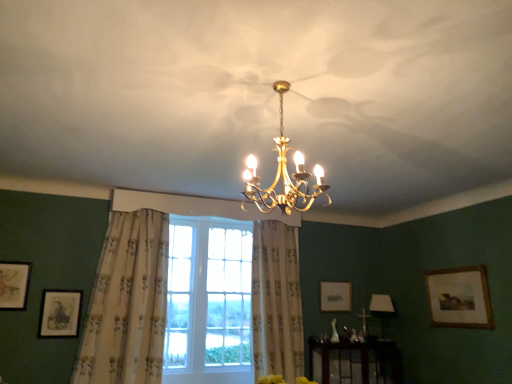
You are a GUI agent. You are given a task and a screenshot of the screen. Output one action in this format:
    pyautogui.click(x=<x>, y=<y>)
    Task: Click on the matte white lampshade at lower right, positioned as the 2th lamp in front-to-back order
    
    Given the screenshot: What is the action you would take?
    pyautogui.click(x=382, y=309)

This screenshot has width=512, height=384. Identify the location of beige floral fabric curtain at center, which ranks as the first curtain in right-to-left order. (276, 301).

This screenshot has width=512, height=384. What do you see at coordinates (459, 298) in the screenshot? I see `wooden framed painting at right, which appears as the first picture frame when viewed from the right` at bounding box center [459, 298].

Describe the element at coordinates (283, 175) in the screenshot. I see `gold metallic chandelier at center, the 2th lamp positioned from the back` at that location.

What do you see at coordinates (355, 362) in the screenshot? This screenshot has width=512, height=384. I see `wooden cabinet at lower center` at bounding box center [355, 362].

Identify the location of matte silver picture frame at center-right, the first picture frame positioned from the back. The height and width of the screenshot is (384, 512). (335, 296).

Which is more to the right, matte white lampshade at lower right, placed as the first lamp when sorted from back to front, or beige floral fabric curtain at center, which ranks as the first curtain in right-to-left order?

matte white lampshade at lower right, placed as the first lamp when sorted from back to front, is more to the right.

Is point (389, 300) farther from viewer compared to point (289, 323)?

Yes.

Could beige floral fabric curtain at center, which ranks as the first curtain in right-to-left order, be considered to be inside matte white lampshade at lower right, placed as the first lamp when sorted from back to front?

Actually, beige floral fabric curtain at center, which ranks as the first curtain in right-to-left order, is outside matte white lampshade at lower right, placed as the first lamp when sorted from back to front.

Could you tell me if matte white lampshade at lower right, placed as the first lamp when sorted from back to front, is turned towards beige floral fabric curtain at center, the 2th curtain positioned from the left?

No, matte white lampshade at lower right, placed as the first lamp when sorted from back to front, is not oriented towards beige floral fabric curtain at center, the 2th curtain positioned from the left.

Considering the positions of objects white floral fabric curtain at left, arranged as the 2th curtain when viewed from the right, and wooden cabinet at lower center in the image provided, who is in front, white floral fabric curtain at left, arranged as the 2th curtain when viewed from the right, or wooden cabinet at lower center?

white floral fabric curtain at left, arranged as the 2th curtain when viewed from the right, is closer to the camera.

Measure the distance between white floral fabric curtain at left, arranged as the 1th curtain when viewed from the left, and wooden cabinet at lower center.

Answer: They are 6.32 feet apart.

From their relative heights in the image, would you say white floral fabric curtain at left, arranged as the 2th curtain when viewed from the right, is taller or shorter than wooden cabinet at lower center?

Clearly, white floral fabric curtain at left, arranged as the 2th curtain when viewed from the right, is taller compared to wooden cabinet at lower center.

Which is closer to the camera, (118, 236) or (357, 344)?

Clearly, point (118, 236) is closer to the camera than point (357, 344).

In the scene shown: Is gold metallic chandelier at center, the second lamp positioned from the right, taller than matte silver picture frame at center-right, the 3th picture frame in the left-to-right sequence?

Indeed, gold metallic chandelier at center, the second lamp positioned from the right, has a greater height compared to matte silver picture frame at center-right, the 3th picture frame in the left-to-right sequence.

Looking at this image, is gold metallic chandelier at center, the 1th lamp from the front, not near matte silver picture frame at center-right, the first picture frame positioned from the back?

That's right, there is a large distance between gold metallic chandelier at center, the 1th lamp from the front, and matte silver picture frame at center-right, the first picture frame positioned from the back.

Is gold metallic chandelier at center, the second lamp positioned from the right, positioned beyond the bounds of matte silver picture frame at center-right, which appears as the fourth picture frame when viewed from the front?

Indeed, gold metallic chandelier at center, the second lamp positioned from the right, is completely outside matte silver picture frame at center-right, which appears as the fourth picture frame when viewed from the front.

Considering the relative sizes of matte white lampshade at lower right, which appears as the second lamp when viewed from the top, and matte gold picture frame at left, acting as the fourth picture frame starting from the back, in the image provided, is matte white lampshade at lower right, which appears as the second lamp when viewed from the top, smaller than matte gold picture frame at left, acting as the fourth picture frame starting from the back,?

No.

Is matte white lampshade at lower right, which is the 2th lamp in left-to-right order, facing towards matte gold picture frame at left, the 1th picture frame positioned from the front?

No, matte white lampshade at lower right, which is the 2th lamp in left-to-right order, does not turn towards matte gold picture frame at left, the 1th picture frame positioned from the front.

Which of these two, matte white lampshade at lower right, which is the 2th lamp in left-to-right order, or matte gold picture frame at left, placed as the fourth picture frame when sorted from right to left, is thinner?

Thinner between the two is matte gold picture frame at left, placed as the fourth picture frame when sorted from right to left.

From a real-world perspective, relative to matte gold picture frame at left, acting as the fourth picture frame starting from the back, is matte white lampshade at lower right, which is the first lamp from right to left, vertically above or below?

matte white lampshade at lower right, which is the first lamp from right to left, is below matte gold picture frame at left, acting as the fourth picture frame starting from the back.

From the picture: Would you say wooden framed painting at right, which is the 4th picture frame from left to right, contains beige floral fabric curtain at center, the 2th curtain positioned from the left?

No, beige floral fabric curtain at center, the 2th curtain positioned from the left, is not surrounded by wooden framed painting at right, which is the 4th picture frame from left to right.

Can you tell me how much wooden framed painting at right, which appears as the first picture frame when viewed from the right, and beige floral fabric curtain at center, the 2th curtain positioned from the left, differ in facing direction?

The angle between the facing direction of wooden framed painting at right, which appears as the first picture frame when viewed from the right, and the facing direction of beige floral fabric curtain at center, the 2th curtain positioned from the left, is 89.6 degrees.

From the picture: Considering the relative sizes of wooden framed painting at right, which is the 4th picture frame from left to right, and beige floral fabric curtain at center, which ranks as the first curtain in right-to-left order, in the image provided, is wooden framed painting at right, which is the 4th picture frame from left to right, bigger than beige floral fabric curtain at center, which ranks as the first curtain in right-to-left order,?

Actually, wooden framed painting at right, which is the 4th picture frame from left to right, might be smaller than beige floral fabric curtain at center, which ranks as the first curtain in right-to-left order.

Could you tell me if wooden framed painting at right, marked as the third picture frame in a front-to-back arrangement, is turned towards beige floral fabric curtain at center, which ranks as the first curtain in right-to-left order?

Yes, wooden framed painting at right, marked as the third picture frame in a front-to-back arrangement, is turned towards beige floral fabric curtain at center, which ranks as the first curtain in right-to-left order.

From the image's perspective, is matte gold picture frame at left, the 1th picture frame positioned from the front, under matte silver picture frame at center-right, the second picture frame when ordered from right to left?

Incorrect, from the image's perspective, matte gold picture frame at left, the 1th picture frame positioned from the front, is higher than matte silver picture frame at center-right, the second picture frame when ordered from right to left.

Does matte gold picture frame at left, the 1th picture frame when ordered from left to right, lie behind matte silver picture frame at center-right, the first picture frame positioned from the back?

No, the depth of matte gold picture frame at left, the 1th picture frame when ordered from left to right, is less than that of matte silver picture frame at center-right, the first picture frame positioned from the back.

Is matte silver picture frame at center-right, the 3th picture frame in the left-to-right sequence, completely or partially inside matte gold picture frame at left, the 1th picture frame positioned from the front?

No, matte gold picture frame at left, the 1th picture frame positioned from the front, does not contain matte silver picture frame at center-right, the 3th picture frame in the left-to-right sequence.

Is matte gold picture frame at left, the 1th picture frame when ordered from left to right, turned away from matte silver picture frame at center-right, which appears as the fourth picture frame when viewed from the front?

No, matte silver picture frame at center-right, which appears as the fourth picture frame when viewed from the front, is not at the back of matte gold picture frame at left, the 1th picture frame when ordered from left to right.

From the image's perspective, which is above, clear glass window at center or beige floral fabric curtain at center, which ranks as the first curtain in right-to-left order?

beige floral fabric curtain at center, which ranks as the first curtain in right-to-left order, from the image's perspective.

Does point (185, 316) come closer to viewer compared to point (270, 231)?

Yes, it is in front of point (270, 231).

Is beige floral fabric curtain at center, the 2th curtain positioned from the left, inside clear glass window at center?

No, beige floral fabric curtain at center, the 2th curtain positioned from the left, is not surrounded by clear glass window at center.

Is clear glass window at center bigger than beige floral fabric curtain at center, which ranks as the first curtain in right-to-left order?

Actually, clear glass window at center might be smaller than beige floral fabric curtain at center, which ranks as the first curtain in right-to-left order.

This screenshot has width=512, height=384. What are the coordinates of `lamp that appears on the right of beige floral fabric curtain at center, which ranks as the first curtain in right-to-left order` in the screenshot? It's located at (382, 309).

Image resolution: width=512 pixels, height=384 pixels. What are the coordinates of `furniture behind the white floral fabric curtain at left, arranged as the 1th curtain when viewed from the left` in the screenshot? It's located at (355, 362).

From the image, which object appears to be farther from matte gold picture frame at lower left, placed as the third picture frame when sorted from back to front, clear glass window at center or wooden framed painting at right, marked as the third picture frame in a front-to-back arrangement?

Among the two, wooden framed painting at right, marked as the third picture frame in a front-to-back arrangement, is located further to matte gold picture frame at lower left, placed as the third picture frame when sorted from back to front.

From the image, which object appears to be farther from beige floral fabric curtain at center, which ranks as the first curtain in right-to-left order, wooden framed painting at right, which is the 4th picture frame from left to right, or gold metallic chandelier at center, which is the 1th lamp from top to bottom?

Based on the image, gold metallic chandelier at center, which is the 1th lamp from top to bottom, appears to be further to beige floral fabric curtain at center, which ranks as the first curtain in right-to-left order.

Estimate the real-world distances between objects in this image. Which object is closer to matte silver picture frame at center-right, the first picture frame positioned from the back, beige floral fabric curtain at center, which ranks as the first curtain in right-to-left order, or matte gold picture frame at left, placed as the fourth picture frame when sorted from right to left?

beige floral fabric curtain at center, which ranks as the first curtain in right-to-left order, lies closer to matte silver picture frame at center-right, the first picture frame positioned from the back, than the other object.

Considering their positions, is clear glass window at center positioned further to matte gold picture frame at lower left, arranged as the third picture frame when viewed from the right, than wooden cabinet at lower center?

Based on the image, wooden cabinet at lower center appears to be further to matte gold picture frame at lower left, arranged as the third picture frame when viewed from the right.

When comparing their distances from beige floral fabric curtain at center, the 2th curtain positioned from the left, does matte gold picture frame at left, acting as the fourth picture frame starting from the back, or white floral fabric curtain at left, arranged as the 2th curtain when viewed from the right, seem further?

matte gold picture frame at left, acting as the fourth picture frame starting from the back, lies further to beige floral fabric curtain at center, the 2th curtain positioned from the left, than the other object.

From the picture: Which object lies further to the anchor point matte white lampshade at lower right, which appears as the second lamp when viewed from the top, gold metallic chandelier at center, acting as the second lamp starting from the bottom, or matte silver picture frame at center-right, the 3th picture frame in the left-to-right sequence?

gold metallic chandelier at center, acting as the second lamp starting from the bottom.

Looking at this image, considering their positions, is wooden framed painting at right, marked as the third picture frame in a front-to-back arrangement, positioned further to matte gold picture frame at left, the 1th picture frame when ordered from left to right, than gold metallic chandelier at center, the 1th lamp from the front?

Based on the image, wooden framed painting at right, marked as the third picture frame in a front-to-back arrangement, appears to be further to matte gold picture frame at left, the 1th picture frame when ordered from left to right.

Estimate the real-world distances between objects in this image. Which object is closer to clear glass window at center, wooden cabinet at lower center or white floral fabric curtain at left, arranged as the 2th curtain when viewed from the right?

Based on the image, white floral fabric curtain at left, arranged as the 2th curtain when viewed from the right, appears to be nearer to clear glass window at center.

Locate an element on the screen. lamp between wooden cabinet at lower center and wooden framed painting at right, which is the 4th picture frame from left to right, in the horizontal direction is located at coordinates (382, 309).

This screenshot has height=384, width=512. I want to click on picture frame between matte gold picture frame at left, placed as the fourth picture frame when sorted from right to left, and clear glass window at center from left to right, so click(x=60, y=313).

Find the location of a particular element. picture frame between matte gold picture frame at lower left, arranged as the third picture frame when viewed from the right, and wooden framed painting at right, which appears as the first picture frame when viewed from the right is located at coordinates (335, 296).

At what (x,y) coordinates should I click in order to perform the action: click on furniture between gold metallic chandelier at center, the 1th lamp from the front, and matte silver picture frame at center-right, which appears as the fourth picture frame when viewed from the front, in the front-back direction. Please return your answer as a coordinate pair (x, y). Looking at the image, I should click on tap(355, 362).